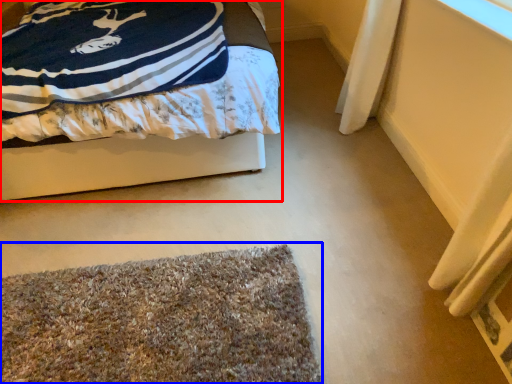
Question: Which point is closer to the camera, bed (highlighted by a red box) or mat (highlighted by a blue box)?

Choices:
 (A) bed
 (B) mat

Answer: (B)